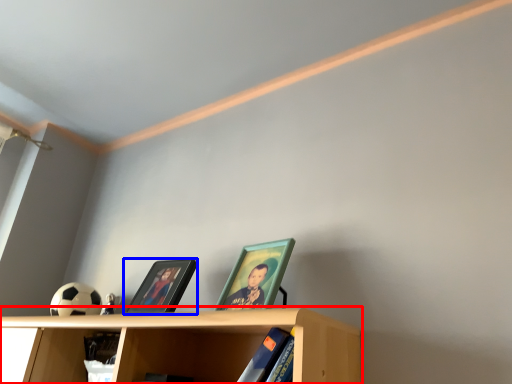
Question: Which object appears farthest to the camera in this image, shelf (highlighted by a red box) or picture frame (highlighted by a blue box)?

Choices:
 (A) shelf
 (B) picture frame

Answer: (B)